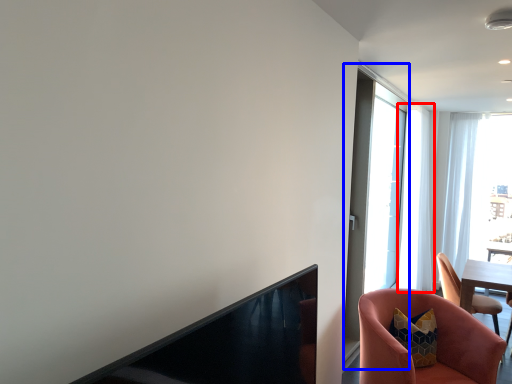
Question: Which object is further to the camera taking this photo, curtain (highlighted by a red box) or screen door (highlighted by a blue box)?

Choices:
 (A) curtain
 (B) screen door

Answer: (A)